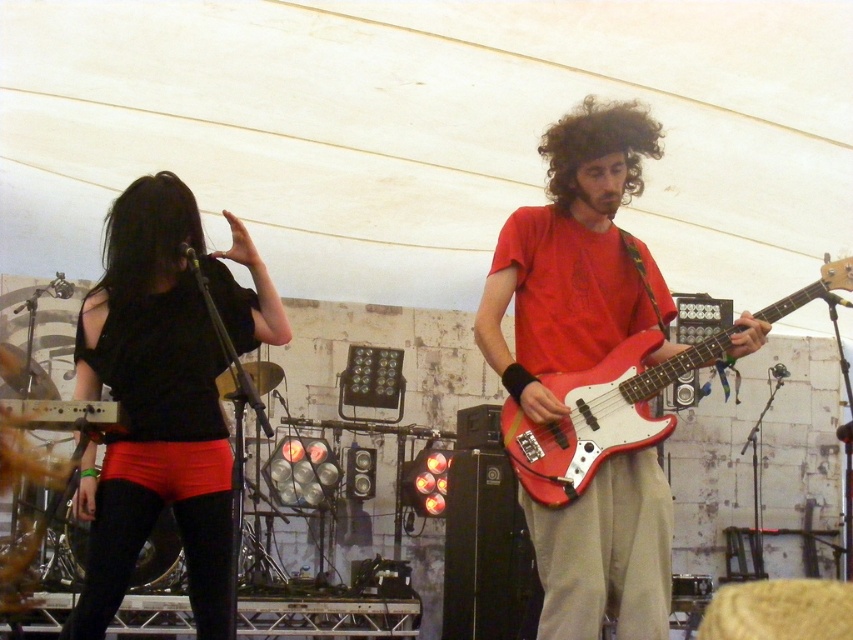
Does black matte shirt at left appear under matte red electric guitar at right?

Yes.

Which is behind, point (148, 401) or point (613, 356)?

The point (148, 401) is behind.

Does point (252, 317) come in front of point (607, 355)?

No, it is behind (607, 355).

Where is `black matte shirt at left`? The width and height of the screenshot is (853, 640). black matte shirt at left is located at coordinates (163, 397).

Which is below, matte red guitar at center or matte red electric guitar at right?

matte red electric guitar at right is below.

Who is higher up, matte red guitar at center or matte red electric guitar at right?

matte red guitar at center

You are a GUI agent. You are given a task and a screenshot of the screen. Output one action in this format:
    pyautogui.click(x=<x>, y=<y>)
    Task: Click on the matte red guitar at center
    
    Given the screenshot: What is the action you would take?
    pyautogui.click(x=573, y=259)

Where is `matte red guitar at center`? matte red guitar at center is located at coordinates (573, 259).

How distant is matte red guitar at center from black matte shirt at left?

3.35 feet

Is matte red guitar at center bigger than black matte shirt at left?

Indeed, matte red guitar at center has a larger size compared to black matte shirt at left.

Does point (634, 241) lie in front of point (204, 253)?

Yes, it is.

Where is `matte red guitar at center`? This screenshot has height=640, width=853. matte red guitar at center is located at coordinates (573, 259).